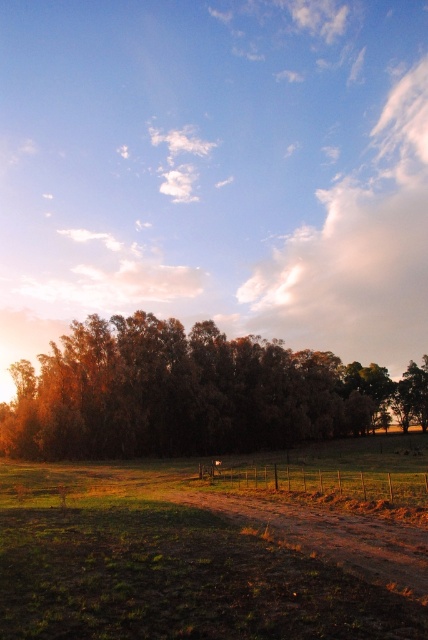
You are a hiker trying to determine the best path through the landscape. Given that the brown textured trees at center and the brown dirt track at center are both at the center, which one would you choose to walk on and why?

You should walk on the brown dirt track at center because it is narrower than the brown textured trees at center, making it a safer and more navigable path.

Based on the photo, you are a hiker who wants to take a photo of the brown textured trees at center from above the brown dirt track at center. Is this possible based on their positions?

The brown textured trees at center are located below the brown dirt track at center, so you can take a photo of them from above the brown dirt track at center.